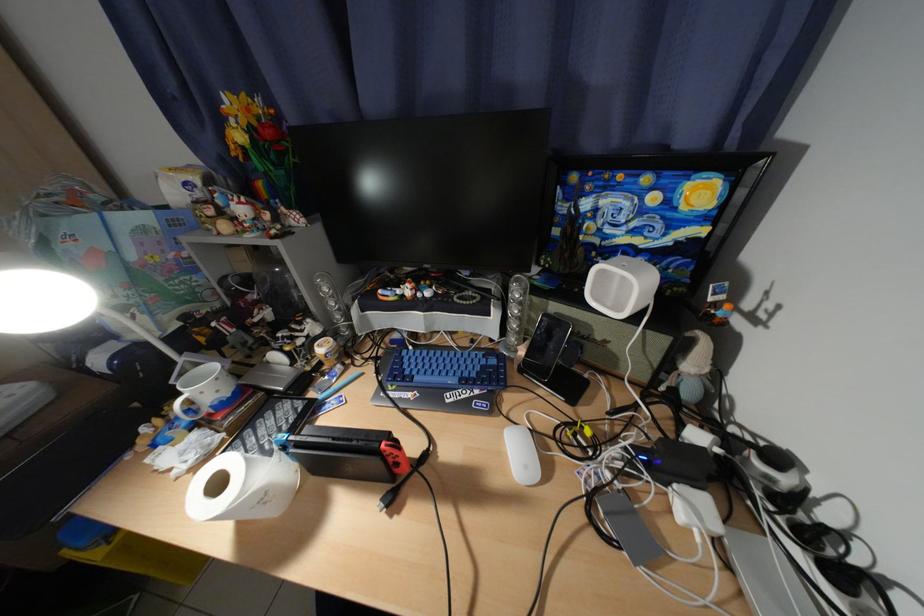
Which object does [242,487] point to?

It refers to a white toilet paper roll.